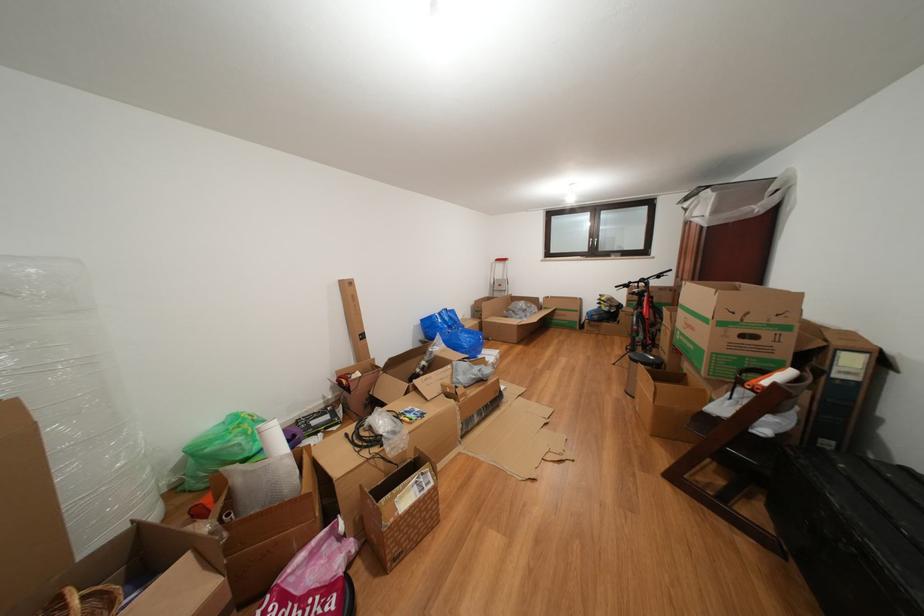
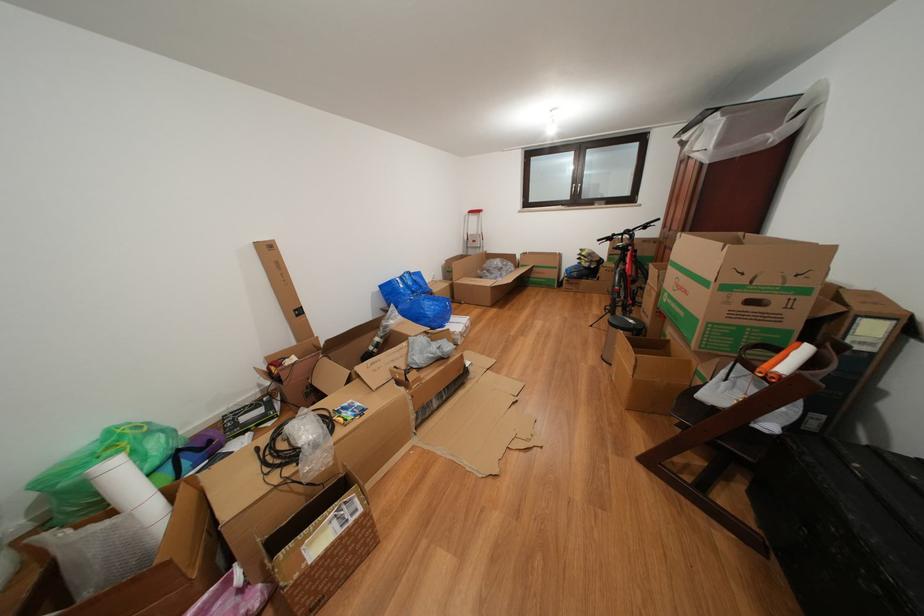
The images are taken continuously from a first-person perspective. In which direction are you moving?

The cameraman moved toward right, forward.